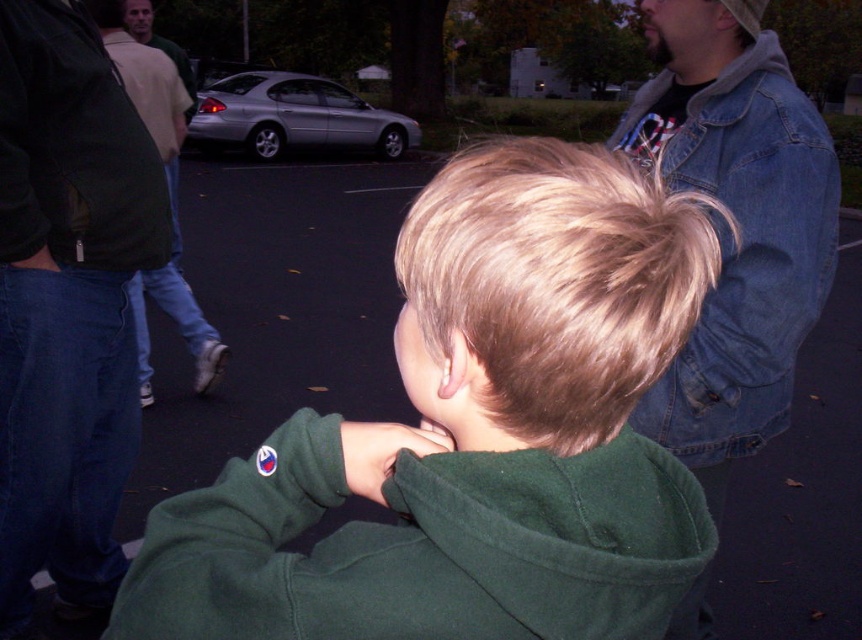
Between dark green fleece sweatshirt at left and light brown denim jeans at left, which one has more height?

With more height is dark green fleece sweatshirt at left.

Describe the element at coordinates (73, 147) in the screenshot. I see `dark green fleece sweatshirt at left` at that location.

Between point (151, 211) and point (125, 83), which one is positioned behind?

Positioned behind is point (125, 83).

The image size is (862, 640). Find the location of `dark green fleece sweatshirt at left`. dark green fleece sweatshirt at left is located at coordinates (73, 147).

You are a GUI agent. You are given a task and a screenshot of the screen. Output one action in this format:
    pyautogui.click(x=<x>, y=<y>)
    Task: Click on the green fleece jacket at center
    
    Given the screenshot: What is the action you would take?
    pyautogui.click(x=473, y=433)

Which is more to the right, green fleece jacket at center or denim jacket at upper right?

Positioned to the right is denim jacket at upper right.

I want to click on green fleece jacket at center, so click(x=473, y=433).

Where is `green fleece jacket at center`? green fleece jacket at center is located at coordinates (473, 433).

Can you confirm if green fleece jacket at center is shorter than light brown denim jeans at left?

Yes.

Is point (670, 612) in front of point (152, 65)?

That is True.

Find the location of a particular element. Image resolution: width=862 pixels, height=640 pixels. green fleece jacket at center is located at coordinates (473, 433).